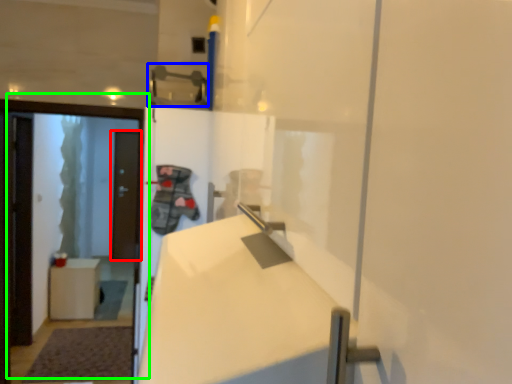
Question: Which is farther away from door (highlighted by a red box)? door handle (highlighted by a blue box) or door (highlighted by a green box)?

Choices:
 (A) door handle
 (B) door

Answer: (A)